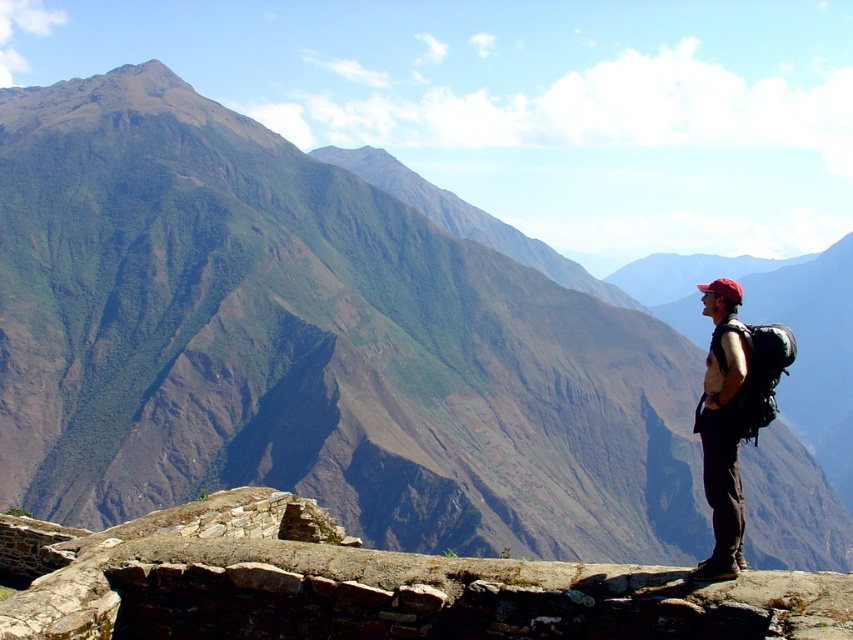
You are a hiker who wants to place your matte black backpack at right on the ground next to the rustic stone wall at center. Given that the backpack requires 2 feet of space around it to avoid damage, is there enough space between them?

The rustic stone wall at center and matte black backpack at right are 30.78 feet apart from each other. Since the backpack needs only 2 feet of space, there is more than enough room between them to place the backpack safely without any damage.

You are a hiker who wants to take a photo of the rustic stone wall at center and the matte black backpack at right. Which object should you focus on first to ensure both are in the frame?

The rustic stone wall at center is wider than the matte black backpack at right, so you should focus on the rustic stone wall at center first to ensure both are in the frame.